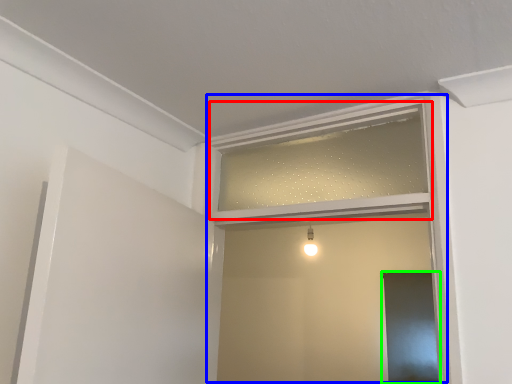
Question: Which object is positioned closest to window frame (highlighted by a red box)? Select from window frame (highlighted by a blue box) and screen door (highlighted by a green box).

Choices:
 (A) window frame
 (B) screen door

Answer: (A)